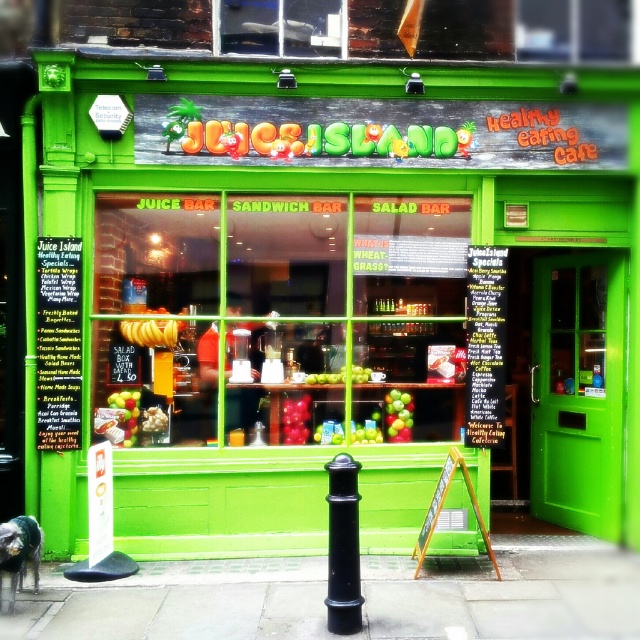
From the picture: You are a customer standing at the entrance of Juice Island. You see the green matte bananas at left and the green matte apple at center in the window display. If you want to reach the apple first, which item should you walk towards?

The green matte apple at center is closer to you than the green matte bananas at left, so you should walk towards the green matte apple at center to reach it first.

You are standing in front of the Juice Island storefront. Where is the paved concrete sidewalk at center located in the image?

The paved concrete sidewalk at center is located at point (504, 595) in the image.

You are a customer looking at the window display of Juice Island. You see green matte bananas at left and yellow matte bananas at center. Which bananas are positioned to the left of the other?

The green matte bananas at left are positioned to the left of the yellow matte bananas at center.